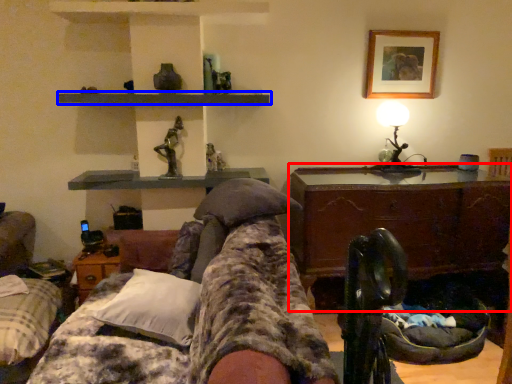
Question: Among these objects, which one is nearest to the camera, table (highlighted by a red box) or shelf (highlighted by a blue box)?

Choices:
 (A) table
 (B) shelf

Answer: (B)